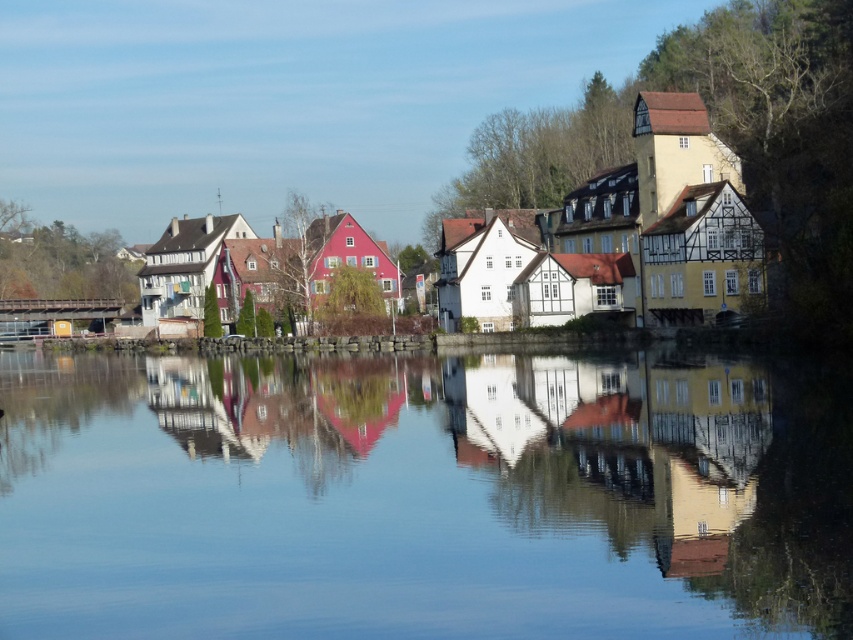
You are a tourist standing on the riverside path and want to take a photo of both the transparent glass water at center and the wooden houses at center. Which object will appear smaller in your photo?

The transparent glass water at center will appear smaller in the photo because it occupies less space than the wooden houses at center according to the description.

You are a tourist standing on the riverside path and want to take a photo of the wooden houses at center and their reflections in the transparent glass water at center. Which object should you focus on first to capture both the houses and their reflections clearly?

You should focus on the wooden houses at center first because the transparent glass water at center is located below them, so capturing the houses in focus will naturally include their reflections in the water below.

You are a tourist standing on the riverside path and want to take a photo of both the transparent glass water at center and the wooden houses at center. Can you fit both into your camera frame if your camera has a maximum field of view of 50 meters?

The transparent glass water at center and wooden houses at center are 52.70 meters apart from each other, which exceeds the camera field of view of 50 meters. Therefore, you cannot capture both in a single frame.